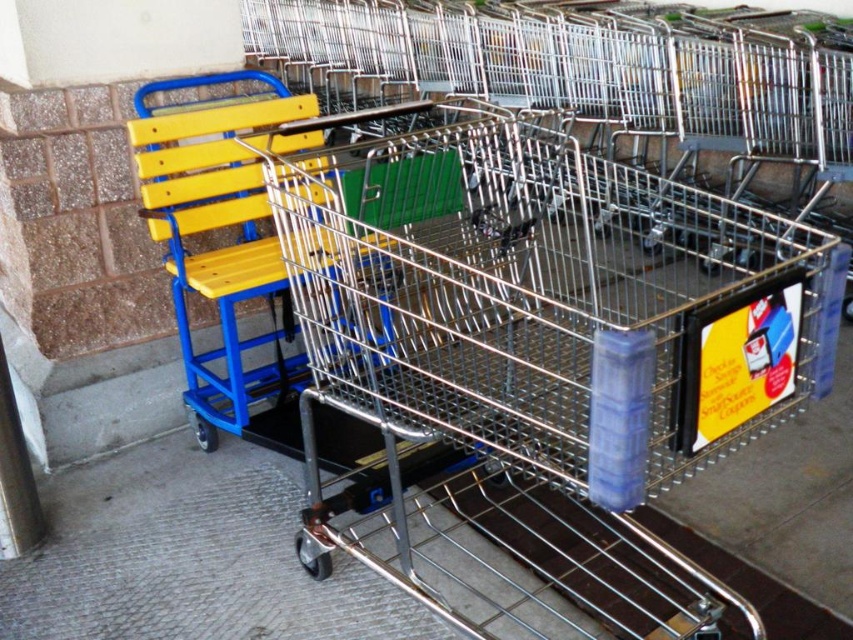
You are standing in a supermarket parking lot and see the metallic silver shopping cart at center. If you want to push it towards the store entrance, which is 4 feet away from you, will you be able to reach it without moving closer?

The metallic silver shopping cart at center is 3.49 feet away from the viewer. Since the store entrance is 4 feet away, the cart is closer than the entrance. Therefore, you can reach it without moving closer because it is within your current reach distance.

You are standing in front of the row of shopping carts and want to determine which of the two points, point (633, 483) or point (209, 422), is nearer to you. Based on the scene description, which point is closer?

Point (633, 483) is closer to the viewer than point (209, 422).